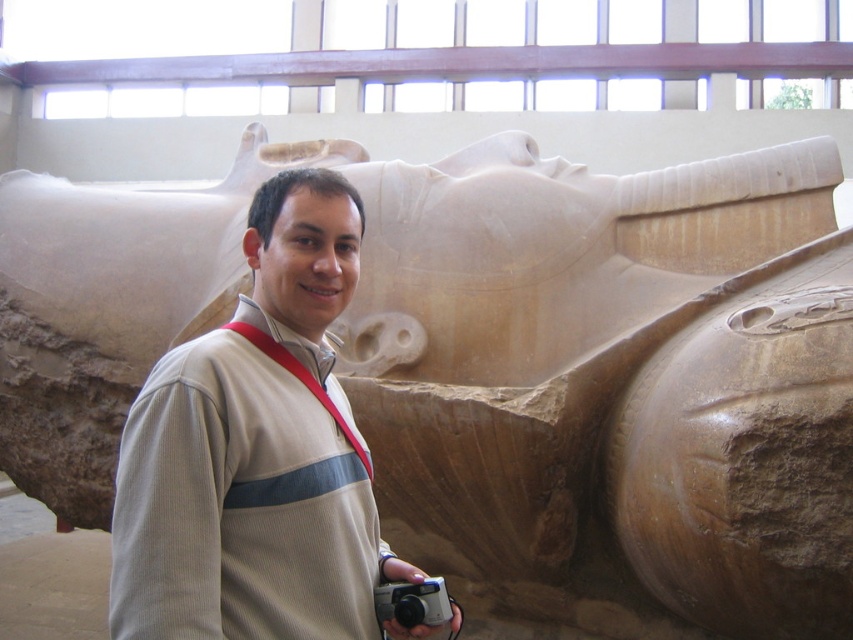
Which is in front, point (369, 563) or point (427, 604)?

Point (427, 604)

Who is more distant from viewer, (289, 312) or (445, 611)?

The point (289, 312) is more distant.

Does point (297, 204) come behind point (390, 609)?

Yes, it is behind point (390, 609).

Find the location of a particular element. This screenshot has width=853, height=640. beige corduroy sweater at center is located at coordinates (256, 452).